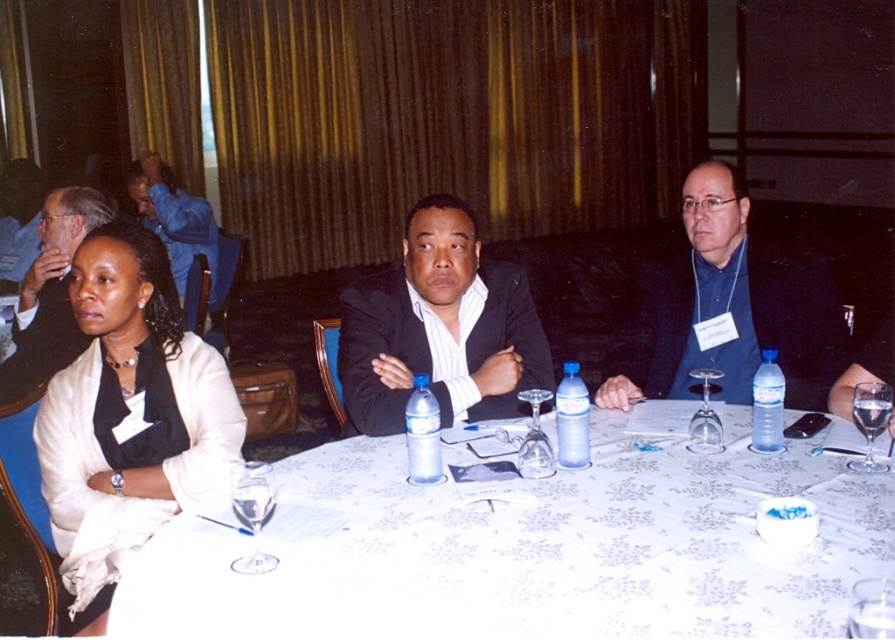
You are standing at the edge of the conference table and want to place a small decorative item between the two points marked as point (717, 548) and point (766, 385). Which point should you move towards first to reach the closer one?

Point (717, 548) is closer to the viewer than point (766, 385), so you should move towards point (717, 548) first.

You are a photographer setting up for a group photo. You need to position a light source to the right of the clear plastic bottle at table center. Will the light source also be to the right of the matte black suit at upper left?

The matte black suit at upper left is to the left of the clear plastic bottle at table center. Therefore, placing the light source to the right of the clear plastic bottle at table center would mean the light source is also to the right of the matte black suit at upper left.

You are organizing a photo shoot and need to arrange two outfits on a table. The outfits are the black matte suit at center and the blue fabric shirt at right. Which outfit takes up more space when placed on the table?

The blue fabric shirt at right takes up more space than the black matte suit at center because the black matte suit at center occupies less space than blue fabric shirt at right.